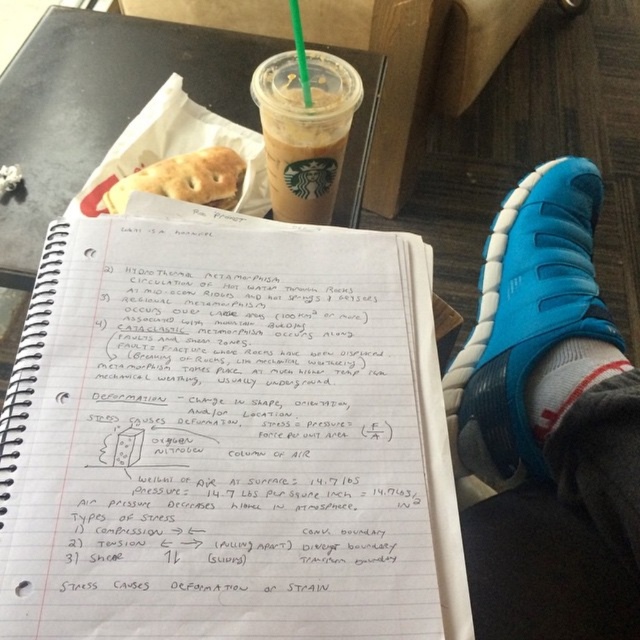
Is translucent plastic cup at upper center wider than green plastic straw at upper center?

Indeed, translucent plastic cup at upper center has a greater width compared to green plastic straw at upper center.

Locate an element on the screen. This screenshot has height=640, width=640. translucent plastic cup at upper center is located at coordinates (305, 131).

Which is in front, point (298, 138) or point (298, 8)?

Positioned in front is point (298, 138).

The width and height of the screenshot is (640, 640). In order to click on translucent plastic cup at upper center in this screenshot , I will do `click(305, 131)`.

Could you measure the distance between transparent plastic cup at upper center and translucent plastic cup at upper center?

The distance of transparent plastic cup at upper center from translucent plastic cup at upper center is 10.30 inches.

Can you confirm if transparent plastic cup at upper center is wider than translucent plastic cup at upper center?

Yes.

Which is in front, point (332, 49) or point (324, 157)?

Point (324, 157) is in front.

You are a GUI agent. You are given a task and a screenshot of the screen. Output one action in this format:
    pyautogui.click(x=<x>, y=<y>)
    Task: Click on the transparent plastic cup at upper center
    
    Given the screenshot: What is the action you would take?
    pyautogui.click(x=100, y=106)

Can you confirm if white paper notebook at center is taller than blue synthetic sandal at lower right?

No.

The width and height of the screenshot is (640, 640). What do you see at coordinates (227, 436) in the screenshot?
I see `white paper notebook at center` at bounding box center [227, 436].

Where is `white paper notebook at center`? white paper notebook at center is located at coordinates (227, 436).